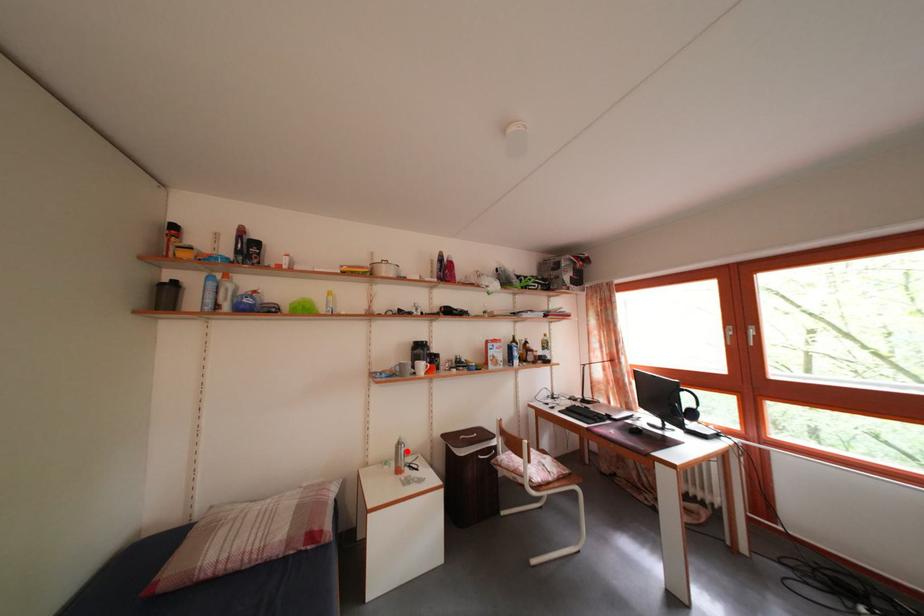
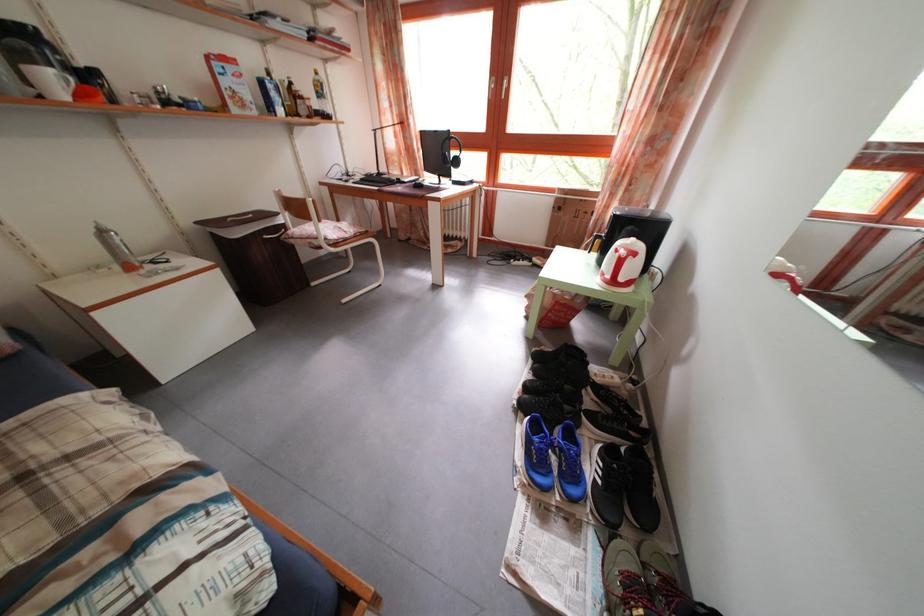
Find the pixel in the second image that matches the highlighted location in the first image.

(108, 238)